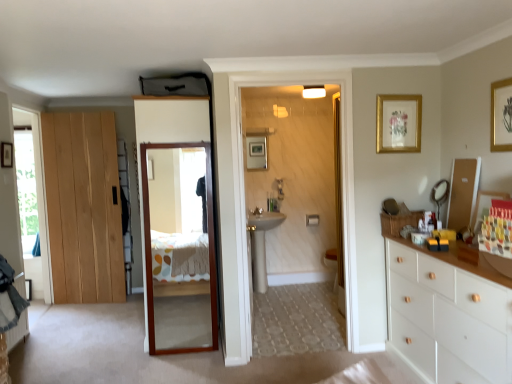
Question: Is gold-framed artwork at upper right, which is counted as the second picture frame, starting from the front, oriented towards clear glass window at left, positioned as the 2th window in front-to-back order?

Choices:
 (A) yes
 (B) no

Answer: (B)

Question: Does gold-framed artwork at upper right, which is counted as the second picture frame, starting from the front, have a smaller size compared to clear glass window at left, positioned as the first window in left-to-right order?

Choices:
 (A) yes
 (B) no

Answer: (A)

Question: Is gold-framed artwork at upper right, the 2th picture frame when ordered from right to left, looking in the opposite direction of clear glass window at left, positioned as the 2th window in front-to-back order?

Choices:
 (A) yes
 (B) no

Answer: (B)

Question: Is gold-framed artwork at upper right, the 2th picture frame when ordered from right to left, closer to the viewer compared to clear glass window at left, positioned as the 2th window in front-to-back order?

Choices:
 (A) yes
 (B) no

Answer: (A)

Question: Does gold-framed artwork at upper right, marked as the 2th picture frame in a left-to-right arrangement, have a larger size compared to clear glass window at left, positioned as the 2th window in front-to-back order?

Choices:
 (A) yes
 (B) no

Answer: (B)

Question: From a real-world perspective, is gold-framed artwork at upper right, marked as the 2th picture frame in a left-to-right arrangement, positioned over clear glass window at left, positioned as the 2th window in front-to-back order, based on gravity?

Choices:
 (A) yes
 (B) no

Answer: (A)

Question: Does light wood door at left, the first door from the back, have a larger size compared to wooden mirror at center, positioned as the 2th door in back-to-front order?

Choices:
 (A) no
 (B) yes

Answer: (A)

Question: From a real-world perspective, is light wood door at left, the 2th door from the front, below wooden mirror at center, positioned as the 2th door in back-to-front order?

Choices:
 (A) no
 (B) yes

Answer: (A)

Question: Is light wood door at left, which is the 2th door in right-to-left order, with wooden mirror at center, the 1th door when ordered from right to left?

Choices:
 (A) no
 (B) yes

Answer: (A)

Question: Can you confirm if light wood door at left, the 2th door from the front, is wider than wooden mirror at center, positioned as the 2th door in back-to-front order?

Choices:
 (A) no
 (B) yes

Answer: (A)

Question: From a real-world perspective, is light wood door at left, the 2th door from the front, positioned over wooden mirror at center, positioned as the 2th door in back-to-front order, based on gravity?

Choices:
 (A) yes
 (B) no

Answer: (A)

Question: From the image's perspective, would you say light wood door at left, the first door from the back, is positioned over wooden mirror at center, the 1th door when ordered from right to left?

Choices:
 (A) yes
 (B) no

Answer: (A)

Question: Considering the relative sizes of gold-framed picture at upper right, marked as the 1th picture frame in a front-to-back arrangement, and wooden mirror at center, the second door positioned from the left, in the image provided, is gold-framed picture at upper right, marked as the 1th picture frame in a front-to-back arrangement, thinner than wooden mirror at center, the second door positioned from the left,?

Choices:
 (A) yes
 (B) no

Answer: (A)